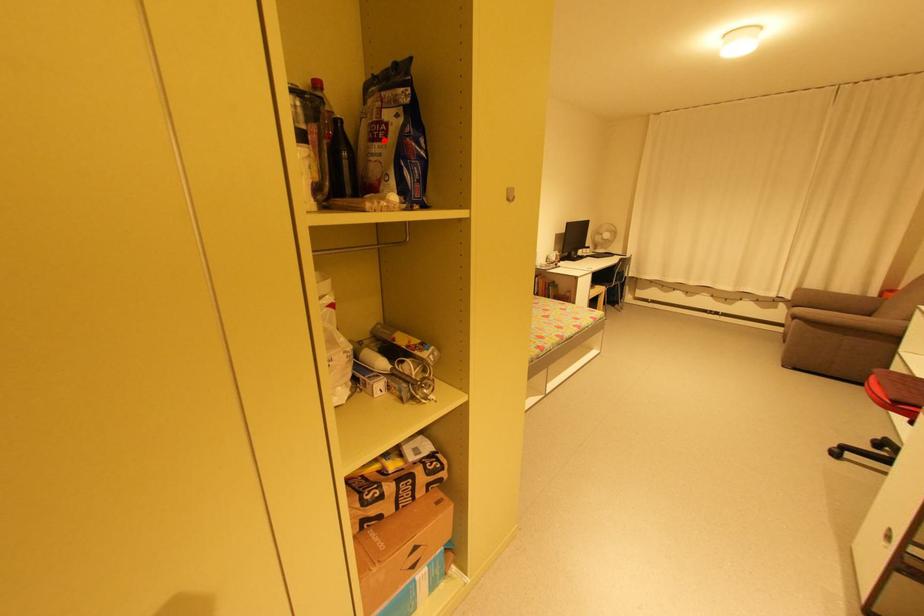
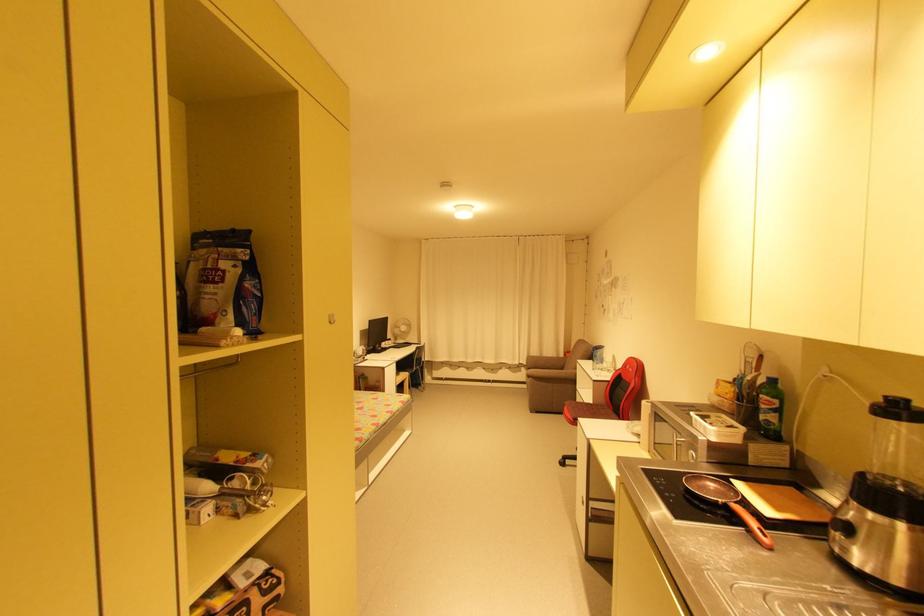
Question: I am providing you with two images of the same scene from different viewpoints. A red point is marked on the first image. Is the red point's position out of view in image 2?

Choices:
 (A) Yes
 (B) No

Answer: (B)